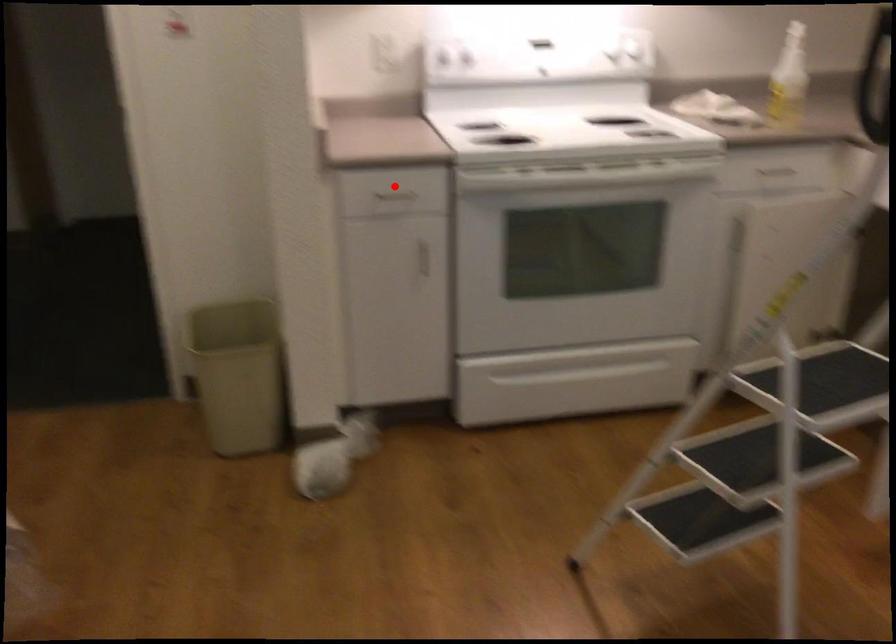
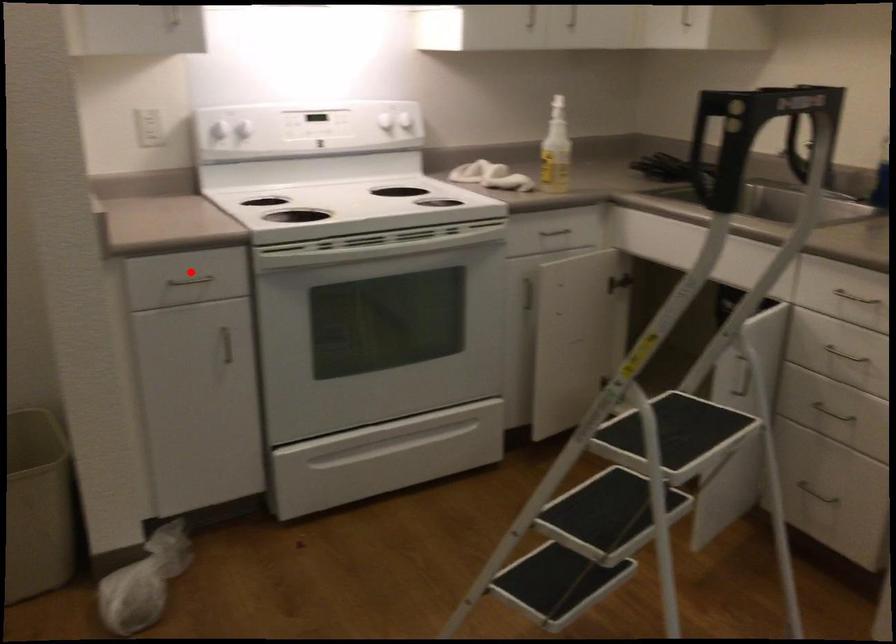
I am providing you with two images of the same scene from different viewpoints. A red point is marked on the first image and another point is marked on the second image. Is the marked point in image1 the same physical position as the marked point in image2?

Yes